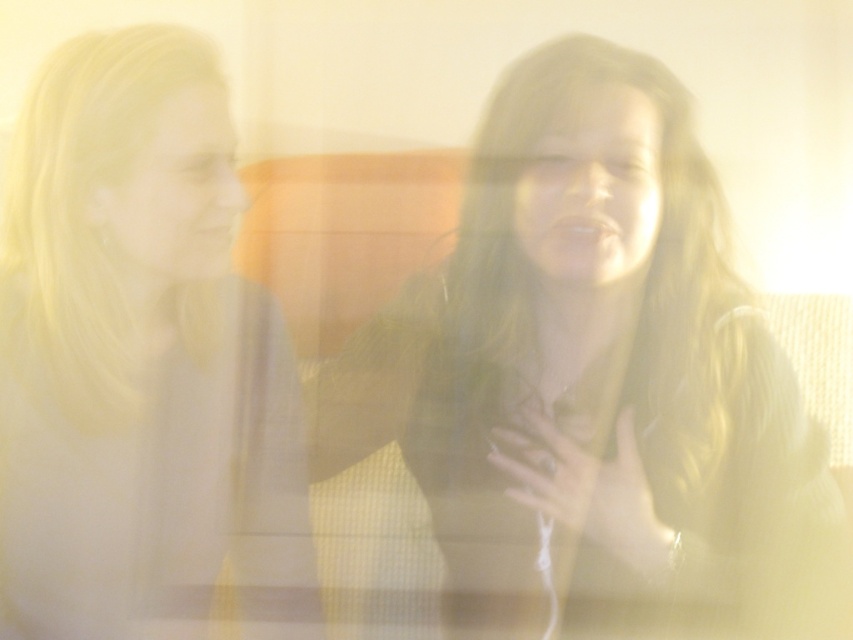
You are standing in a room and see a person wearing a matte black shirt at center. If you want to hand them a book without moving closer, can you reach them from your current position?

The matte black shirt at center and viewer are 30.03 inches apart from each other, so yes, you can reach them without moving closer as the distance is within typical reaching range.

You are standing in front of the image and want to locate the matte black shirt at center. According to the coordinates provided, where exactly is it positioned?

The matte black shirt at center is located at point coordinates 0.589 along the x axis and 0.696 along the y axis.

You are a photographer trying to capture a clear shot of both the smooth white teeth at center and the matte white mouth at center in the image. Since the image is slightly blurred, you need to focus on one first. Based on their positions, which one should you focus on first to ensure the other is also in focus?

The smooth white teeth at center is to the right of matte white mouth at center. Since they are both at the center but positioned side by side, focusing on the matte white mouth at center first would likely keep the smooth white teeth at center in focus as well due to their close proximity.